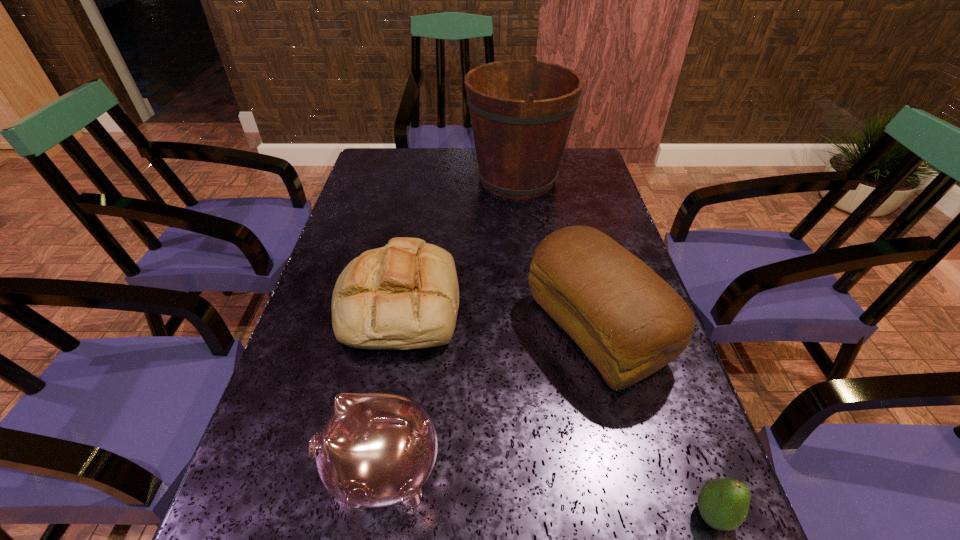
Identify the location of free space between the left bread and the piggy bank. (391, 388).

I want to click on vacant area that lies between the avocado and the fourth tallest object, so pyautogui.click(x=556, y=409).

Where is `free space between the shorter bread and the tallest object`? The image size is (960, 540). free space between the shorter bread and the tallest object is located at coordinates (458, 241).

You are a GUI agent. You are given a task and a screenshot of the screen. Output one action in this format:
    pyautogui.click(x=<x>, y=<y>)
    Task: Click on the free space between the avocado and the fourth shortest object
    The width and height of the screenshot is (960, 540).
    Given the screenshot: What is the action you would take?
    pyautogui.click(x=655, y=422)

At what (x,y) coordinates should I click in order to perform the action: click on free space between the second tallest object and the piggy bank. Please return your answer as a coordinate pair (x, y). This screenshot has height=540, width=960. Looking at the image, I should click on (490, 401).

Where is `vacant area that lies between the left bread and the third shortest object`? The image size is (960, 540). vacant area that lies between the left bread and the third shortest object is located at coordinates (391, 388).

This screenshot has width=960, height=540. I want to click on object that is the third closest to the piggy bank, so click(x=723, y=503).

You are a GUI agent. You are given a task and a screenshot of the screen. Output one action in this format:
    pyautogui.click(x=<x>, y=<y>)
    Task: Click on the object that is the closest to the second tallest object
    The width and height of the screenshot is (960, 540).
    Given the screenshot: What is the action you would take?
    pyautogui.click(x=405, y=295)

This screenshot has height=540, width=960. Identify the location of vacant space that satisfies the following two spatial constraints: 1. on the front side of the shortest object; 2. on the right side of the bucket. (557, 515).

Where is `free region that satisfies the following two spatial constraints: 1. on the front side of the bucket; 2. on the front facing side of the third shortest object`? The height and width of the screenshot is (540, 960). free region that satisfies the following two spatial constraints: 1. on the front side of the bucket; 2. on the front facing side of the third shortest object is located at coordinates (552, 471).